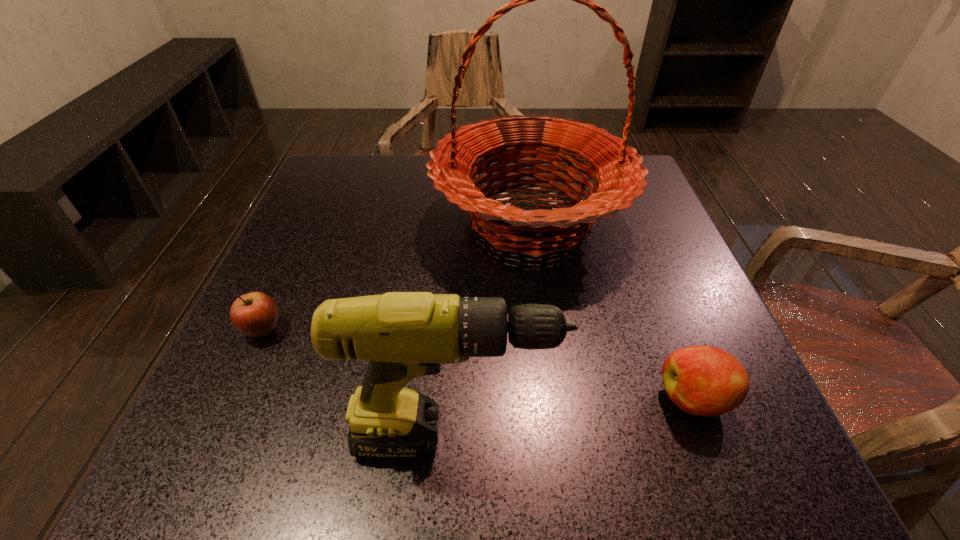
You are a GUI agent. You are given a task and a screenshot of the screen. Output one action in this format:
    pyautogui.click(x=<x>, y=<y>)
    Task: Click on the farthest object
    Image resolution: width=960 pixels, height=540 pixels.
    Given the screenshot: What is the action you would take?
    coord(616,169)

I want to click on basket, so click(x=616, y=169).

Where is `the third shortest object`? the third shortest object is located at coordinates (403, 335).

The height and width of the screenshot is (540, 960). I want to click on the right apple, so click(x=706, y=381).

This screenshot has height=540, width=960. In order to click on the second farthest object in this screenshot , I will do pos(255,314).

I want to click on the leftmost object, so click(255, 314).

You are a GUI agent. You are given a task and a screenshot of the screen. Output one action in this format:
    pyautogui.click(x=<x>, y=<y>)
    Task: Click on the vacant region located on the left of the tallest object
    Image resolution: width=960 pixels, height=540 pixels.
    Given the screenshot: What is the action you would take?
    pyautogui.click(x=330, y=218)

Locate an element on the screen. The height and width of the screenshot is (540, 960). vacant space located on the handle side of the drill is located at coordinates (723, 437).

Where is `vacant space located on the left of the right apple`? This screenshot has height=540, width=960. vacant space located on the left of the right apple is located at coordinates (466, 399).

The width and height of the screenshot is (960, 540). Find the location of `vacant space located 0.210m on the back of the left apple`. vacant space located 0.210m on the back of the left apple is located at coordinates (305, 237).